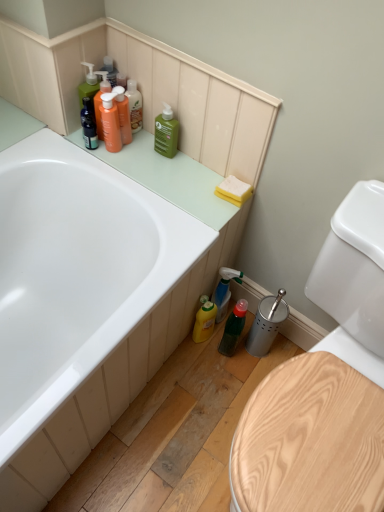
I want to click on vacant area that is in front of translucent orange bottle at upper left, the 1th cleaning product from the top, so click(128, 164).